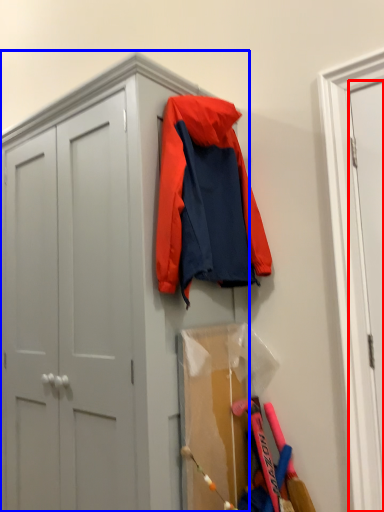
Question: Which object appears closest to the camera in this image, door (highlighted by a red box) or cabinetry (highlighted by a blue box)?

Choices:
 (A) door
 (B) cabinetry

Answer: (B)